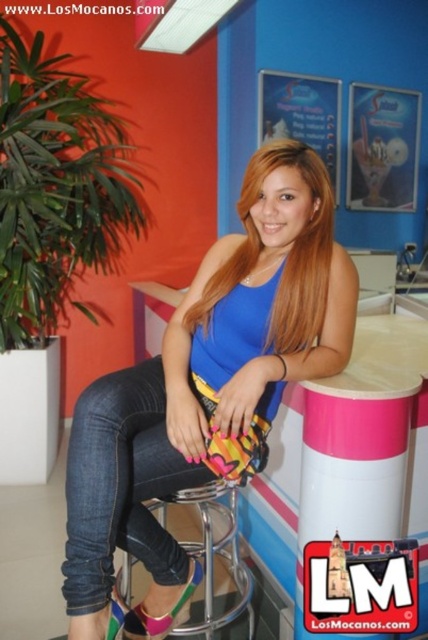
Question: Is blue matte tank top at center positioned in front of blonde silky hair at center?

Choices:
 (A) no
 (B) yes

Answer: (B)

Question: Does pink plastic pillar at right have a smaller size compared to metallic silver bar stool at center?

Choices:
 (A) no
 (B) yes

Answer: (B)

Question: Among these points, which one is farthest from the camera?

Choices:
 (A) (339, 538)
 (B) (125, 630)

Answer: (A)

Question: Can you confirm if metallic silver bar stool at center is smaller than pink fabric sandal at lower left?

Choices:
 (A) no
 (B) yes

Answer: (A)

Question: Which object is the closest to the pink fabric sandal at lower left?

Choices:
 (A) blue matte tank top at center
 (B) pink fabric sandal at lower center

Answer: (B)

Question: Which object is farther from the camera taking this photo?

Choices:
 (A) metallic silver bar stool at center
 (B) pink plastic pillar at right
 (C) pink fabric sandal at lower center

Answer: (C)